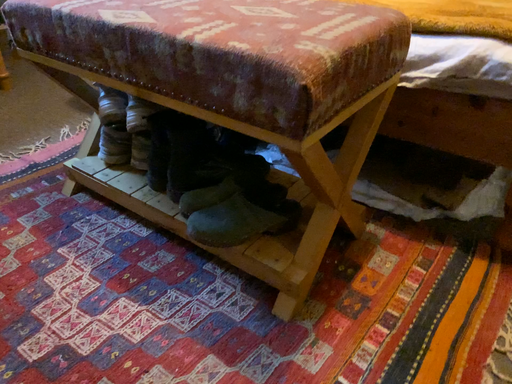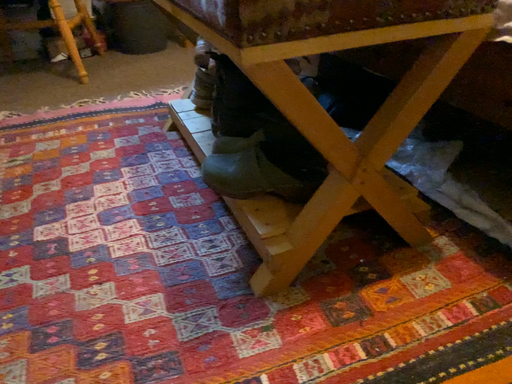
Question: Which way did the camera rotate in the video?

Choices:
 (A) rotated right
 (B) rotated left

Answer: (B)